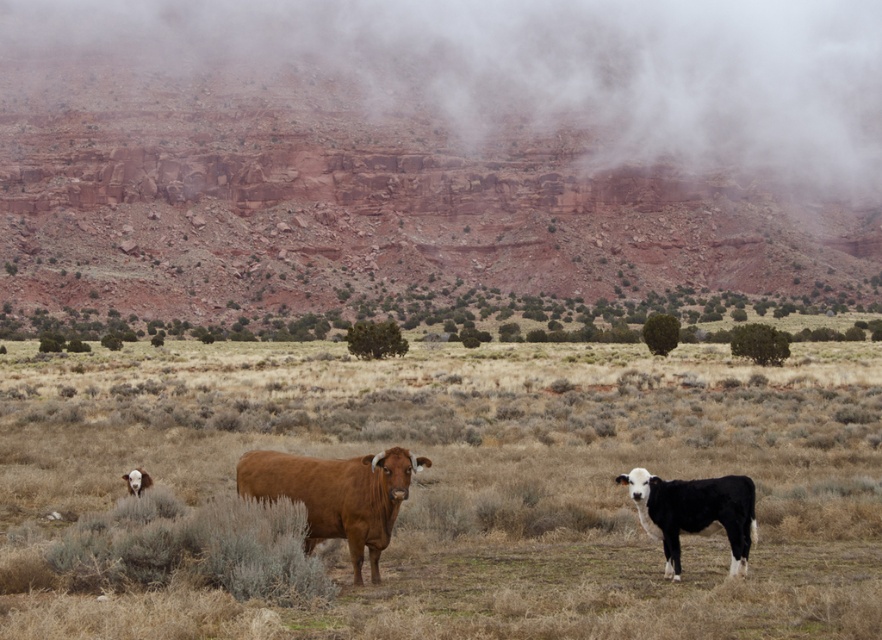
Question: Is dry grass at center behind brown smooth cow at lower left?

Choices:
 (A) yes
 (B) no

Answer: (B)

Question: Which point is closer to the camera taking this photo?

Choices:
 (A) (65, 243)
 (B) (139, 481)
 (C) (653, 115)

Answer: (B)

Question: Considering the relative positions of dry grass at center and reddish-brown rock at upper center in the image provided, where is dry grass at center located with respect to reddish-brown rock at upper center?

Choices:
 (A) below
 (B) above

Answer: (A)

Question: Considering the real-world distances, which object is farthest from the brown smooth cow at lower left?

Choices:
 (A) black smooth calf at lower right
 (B) reddish-brown rock at upper center

Answer: (B)

Question: Does black smooth calf at lower right appear on the right side of brown smooth cow at lower left?

Choices:
 (A) no
 (B) yes

Answer: (B)

Question: Which point is closer to the camera?

Choices:
 (A) (848, 24)
 (B) (370, 472)

Answer: (B)